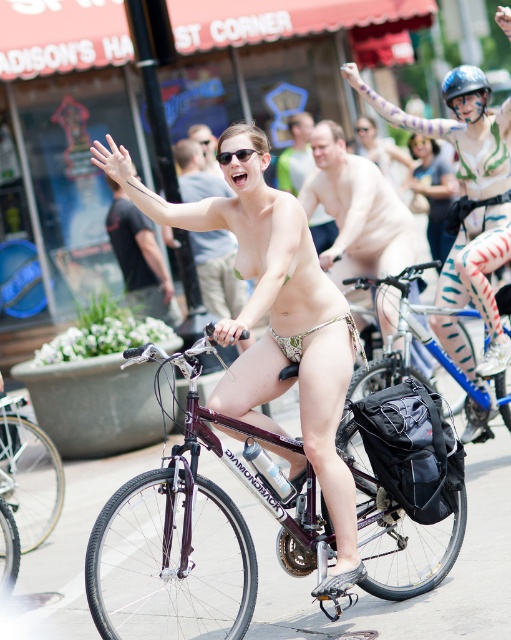
Looking at this image, can you confirm if silver metallic bicycle at center is positioned above shiny metallic bicycle at center?

Actually, silver metallic bicycle at center is below shiny metallic bicycle at center.

The width and height of the screenshot is (511, 640). Identify the location of silver metallic bicycle at center. (29, 474).

How far apart are metallic silver bicycle at center and matte gold bikini at center?

metallic silver bicycle at center is 9.50 meters from matte gold bikini at center.

Between metallic silver bicycle at center and matte gold bikini at center, which one is positioned higher?

matte gold bikini at center

Identify the location of metallic silver bicycle at center. (274, 320).

Is silver metallic bicycle at center to the right of smooth skin man at center from the viewer's perspective?

In fact, silver metallic bicycle at center is to the left of smooth skin man at center.

Who is more distant from viewer, (34,500) or (290,177)?

Point (290,177)

At what (x,y) coordinates should I click in order to perform the action: click on silver metallic bicycle at center. Please return your answer as a coordinate pair (x, y). The image size is (511, 640). Looking at the image, I should click on (29, 474).